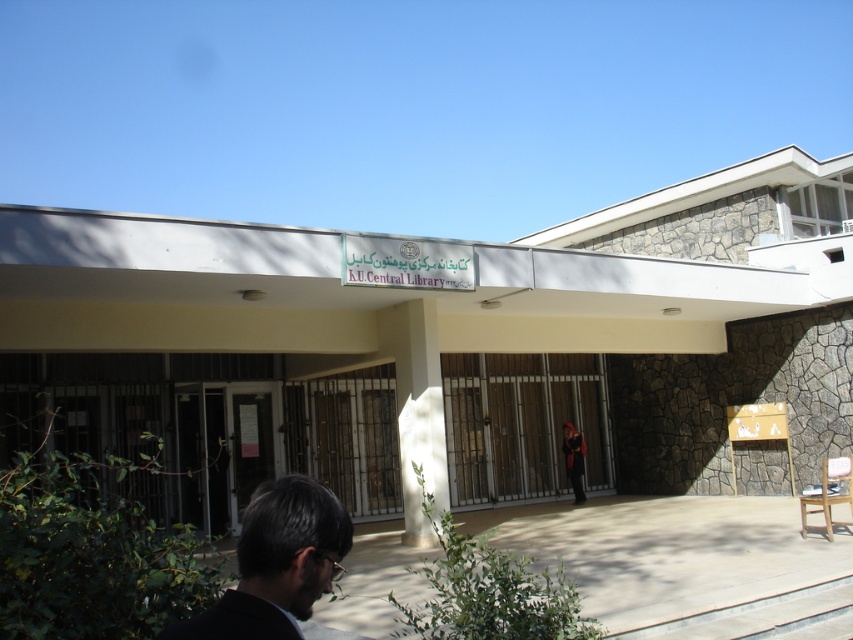
Question: Based on their relative distances, which object is farther from the dark brown hair at lower left?

Choices:
 (A) metallic gate at center
 (B) dark red fabric at center

Answer: (A)

Question: Which point is closer to the camera?

Choices:
 (A) (241, 627)
 (B) (514, 467)
 (C) (579, 440)

Answer: (A)

Question: Is the position of metallic gate at center more distant than that of dark brown hair at lower left?

Choices:
 (A) yes
 (B) no

Answer: (A)

Question: Among these points, which one is farthest from the camera?

Choices:
 (A) (462, 358)
 (B) (253, 556)
 (C) (581, 449)

Answer: (A)

Question: Is dark brown hair at lower left smaller than dark red fabric at center?

Choices:
 (A) no
 (B) yes

Answer: (B)

Question: Does metallic gate at center have a smaller size compared to dark brown hair at lower left?

Choices:
 (A) yes
 (B) no

Answer: (B)